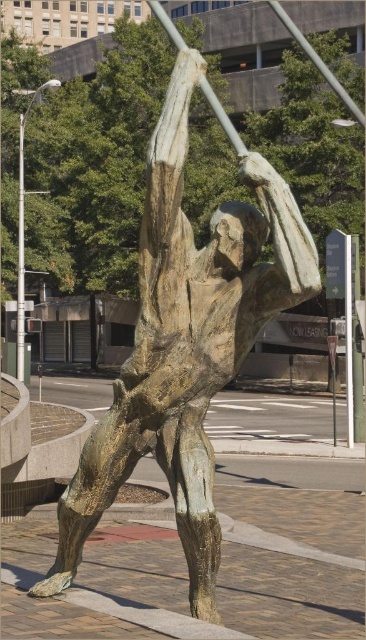
Question: Is bronze statue at center positioned behind smooth white pole at upper center?

Choices:
 (A) no
 (B) yes

Answer: (B)

Question: Considering the relative positions of bronze statue at center and smooth white pole at upper center in the image provided, where is bronze statue at center located with respect to smooth white pole at upper center?

Choices:
 (A) left
 (B) right

Answer: (A)

Question: Among these points, which one is farthest from the camera?

Choices:
 (A) (213, 108)
 (B) (193, 458)

Answer: (A)

Question: Is bronze statue at center further to the viewer compared to smooth white pole at upper center?

Choices:
 (A) yes
 (B) no

Answer: (A)

Question: Which point is closer to the camera?

Choices:
 (A) (163, 440)
 (B) (178, 42)

Answer: (A)